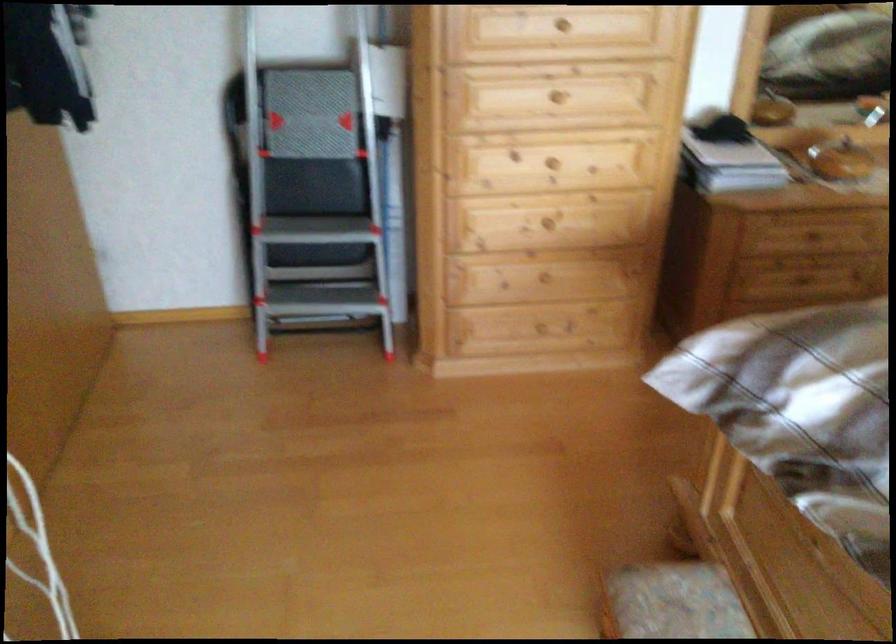
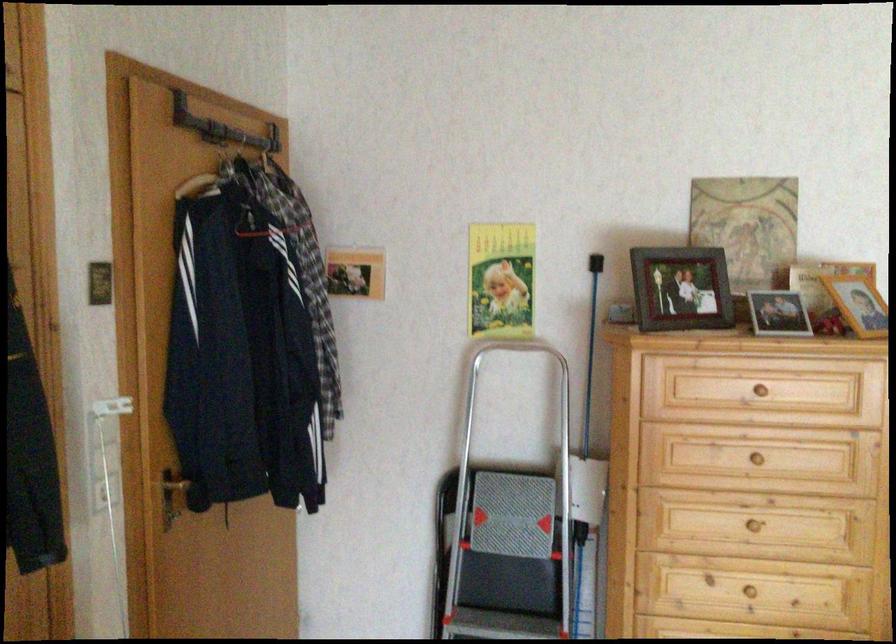
Find the pixel in the second image that matches the point at 384,82 in the first image.

(588, 489)